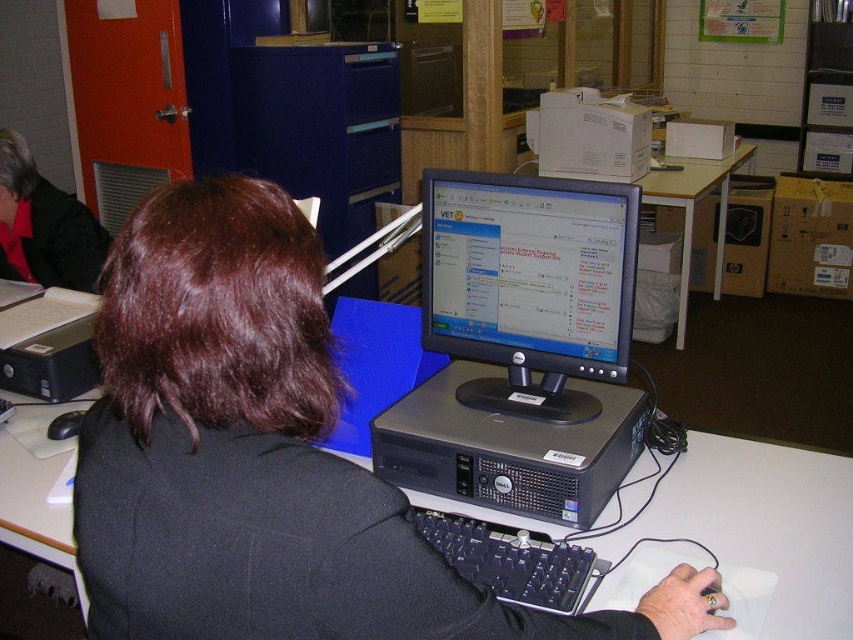
Question: Among these objects, which one is nearest to the camera?

Choices:
 (A) black plastic desktop at center
 (B) black matte jacket at center

Answer: (B)

Question: Which point is farther to the camera?

Choices:
 (A) (171, 300)
 (B) (537, 326)
 (C) (509, 449)
 (D) (22, 205)

Answer: (D)

Question: Does matte black monitor at center appear on the left side of red fabric jacket at upper left?

Choices:
 (A) no
 (B) yes

Answer: (A)

Question: Estimate the real-world distances between objects in this image. Which object is farther from the matte black monitor at center?

Choices:
 (A) wooden table at center
 (B) black matte mouse at lower left
 (C) satin silver desktop at center
 (D) black plastic keyboard at center

Answer: (A)

Question: Is black matte jacket at center below matte black monitor at center?

Choices:
 (A) yes
 (B) no

Answer: (A)

Question: Is black matte jacket at center positioned before black plastic desktop at center?

Choices:
 (A) yes
 (B) no

Answer: (A)